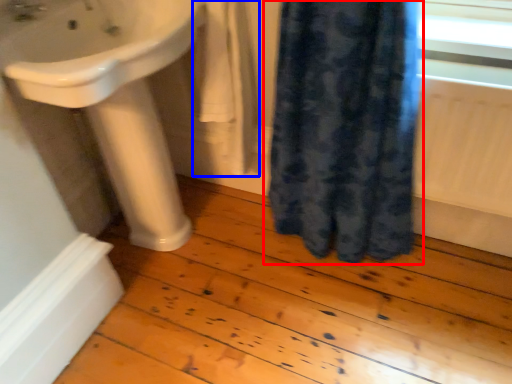
Question: Which point is further to the camera, curtain (highlighted by a red box) or bath towel (highlighted by a blue box)?

Choices:
 (A) curtain
 (B) bath towel

Answer: (B)